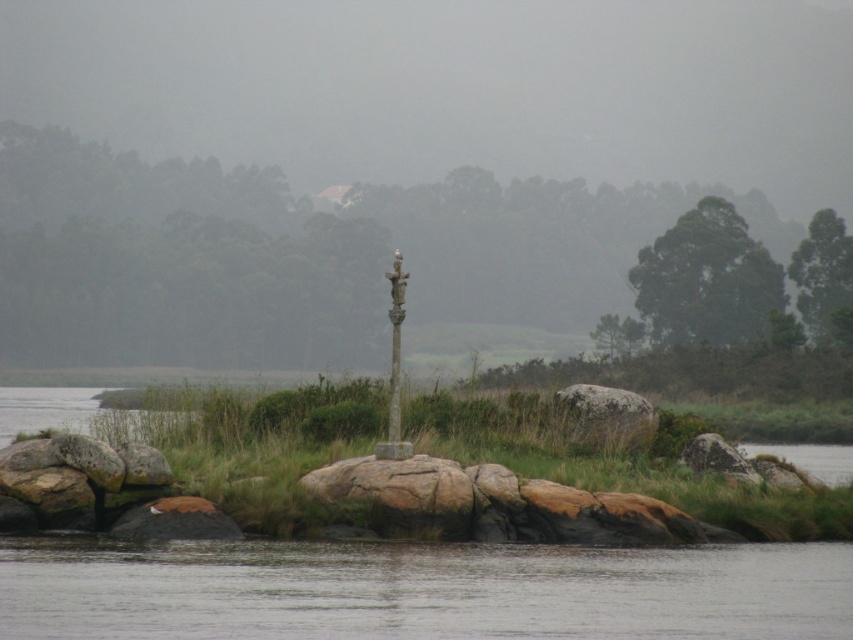
Question: Which of the following is the closest to the observer?

Choices:
 (A) (173, 275)
 (B) (827, 236)

Answer: (B)

Question: Which point appears closest to the camera in this image?

Choices:
 (A) (338, 467)
 (B) (695, 332)
 (C) (396, 376)
 (D) (0, 360)

Answer: (A)

Question: Does green textured tree at upper center have a larger size compared to smooth gray pole at center?

Choices:
 (A) no
 (B) yes

Answer: (B)

Question: Does green matte tree at center appear on the right side of green leafy tree at upper right?

Choices:
 (A) yes
 (B) no

Answer: (B)

Question: Which point is farther to the camera?

Choices:
 (A) green leafy tree at upper right
 (B) gray rough rock at center
 (C) rusty rock at center

Answer: (A)

Question: Does rusty rock at center appear on the right side of brown rough rock at center?

Choices:
 (A) no
 (B) yes

Answer: (A)